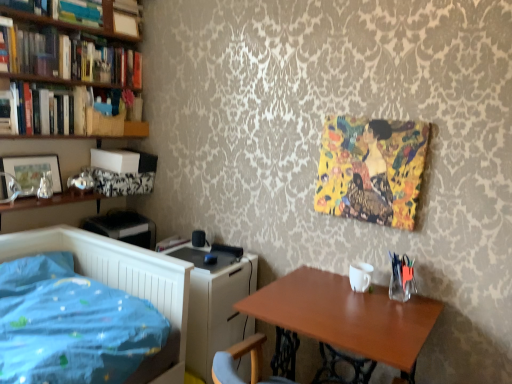
At what (x,y) coordinates should I click in order to perform the action: click on blue matte book at upper left, the 2th book when ordered from top to bottom. Please return your answer as a coordinate pair (x, y). The height and width of the screenshot is (384, 512). Looking at the image, I should click on (77, 12).

At what (x,y) coordinates should I click in order to perform the action: click on matte silver picture frame at upper left. Please return your answer as a coordinate pair (x, y). The height and width of the screenshot is (384, 512). Looking at the image, I should click on (32, 171).

This screenshot has height=384, width=512. What do you see at coordinates (371, 169) in the screenshot?
I see `yellow fabric painting at upper right` at bounding box center [371, 169].

Measure the distance between hardcover books at upper left, the 4th book positioned from the top, and camera.

6.05 feet.

This screenshot has height=384, width=512. I want to click on hardcover book at center, acting as the 1th book starting from the bottom, so click(x=170, y=243).

Measure the distance between point (13,105) and camera.

The distance of point (13,105) from camera is 1.92 meters.

Locate an element on the screen. This screenshot has width=512, height=384. hardcover books at upper left, which is counted as the third book, starting from the top is located at coordinates (75, 24).

I want to click on blue matte book at upper left, the 5th book when ordered from bottom to top, so (x=77, y=12).

From the image's perspective, is yellow fabric painting at upper right above or below hardcover books at upper left, which is counted as the third book, starting from the top?

yellow fabric painting at upper right is situated lower than hardcover books at upper left, which is counted as the third book, starting from the top, in the image.

Looking at this image, can you confirm if yellow fabric painting at upper right is thinner than hardcover books at upper left, which is counted as the fourth book, starting from the bottom?

Yes.

Find the location of `art lying in front of the hardcover books at upper left, which is counted as the third book, starting from the top`. art lying in front of the hardcover books at upper left, which is counted as the third book, starting from the top is located at coordinates (371, 169).

Considering the sizes of yellow fabric painting at upper right and hardcover books at upper left, which is counted as the fourth book, starting from the bottom, in the image, is yellow fabric painting at upper right bigger or smaller than hardcover books at upper left, which is counted as the fourth book, starting from the bottom,?

yellow fabric painting at upper right is smaller than hardcover books at upper left, which is counted as the fourth book, starting from the bottom.

Is matte silver picture frame at upper left aimed at wooden table at lower right?

No, matte silver picture frame at upper left is not aimed at wooden table at lower right.

From the image's perspective, between matte silver picture frame at upper left and wooden table at lower right, who is located below?

wooden table at lower right is shown below in the image.

Is matte silver picture frame at upper left wider or thinner than wooden table at lower right?

Clearly, matte silver picture frame at upper left has less width compared to wooden table at lower right.

From a real-world perspective, is matte white book at upper left, which is the 1th book in top-to-bottom order, positioned above or below white glossy computer desk at center?

In terms of real-world spatial position, matte white book at upper left, which is the 1th book in top-to-bottom order, is above white glossy computer desk at center.

Who is smaller, matte white book at upper left, which is the 1th book in top-to-bottom order, or white glossy computer desk at center?

With smaller size is matte white book at upper left, which is the 1th book in top-to-bottom order.

Considering the relative positions of matte white book at upper left, which is the 6th book from bottom to top, and white glossy computer desk at center in the image provided, is matte white book at upper left, which is the 6th book from bottom to top, to the right of white glossy computer desk at center from the viewer's perspective?

No.

Is hardcover books at upper left, which is counted as the fourth book, starting from the bottom, inside the boundaries of white glossy computer desk at center, or outside?

The correct answer is: outside.

From a real-world perspective, is hardcover books at upper left, which is counted as the fourth book, starting from the bottom, under white glossy computer desk at center?

Actually, hardcover books at upper left, which is counted as the fourth book, starting from the bottom, is physically above white glossy computer desk at center in the real world.

Is hardcover books at upper left, which is counted as the third book, starting from the top, facing towards white glossy computer desk at center?

No, hardcover books at upper left, which is counted as the third book, starting from the top, is not turned towards white glossy computer desk at center.

Looking at this image, is matte silver picture frame at upper left surrounding blue matte book at upper left, the 5th book when ordered from bottom to top?

Definitely not — blue matte book at upper left, the 5th book when ordered from bottom to top, is not inside matte silver picture frame at upper left.

Is matte silver picture frame at upper left facing towards blue matte book at upper left, the 5th book when ordered from bottom to top?

No, matte silver picture frame at upper left is not turned towards blue matte book at upper left, the 5th book when ordered from bottom to top.

Would you say yellow fabric painting at upper right is a long distance from matte silver picture frame at upper left?

That's right, there is a large distance between yellow fabric painting at upper right and matte silver picture frame at upper left.

Locate an element on the screen. art located on the right of matte silver picture frame at upper left is located at coordinates (371, 169).

Does yellow fabric painting at upper right have a lesser width compared to matte silver picture frame at upper left?

Yes.

Which is closer to the camera, [340,173] or [20,168]?

Point [340,173]

Is white glossy computer desk at center positioned with its back to matte white book at upper left, which is the 1th book in top-to-bottom order?

No, white glossy computer desk at center's orientation is not away from matte white book at upper left, which is the 1th book in top-to-bottom order.

Is point (200, 318) in front of point (117, 18)?

Yes, point (200, 318) is closer to viewer.

Which is in front, white glossy computer desk at center or matte white book at upper left, which is the 6th book from bottom to top?

white glossy computer desk at center is closer to the camera.

What's the angular difference between white glossy computer desk at center and matte white book at upper left, which is the 6th book from bottom to top,'s facing directions?

2.57 degrees.

Where is `book that is the 4th object to the left of the yellow fabric painting at upper right, starting at the anchor`? The width and height of the screenshot is (512, 384). book that is the 4th object to the left of the yellow fabric painting at upper right, starting at the anchor is located at coordinates (75, 24).

This screenshot has width=512, height=384. What are the coordinates of `picture frame behind the wooden table at lower right` in the screenshot? It's located at (32, 171).

Which object lies further to the anchor point white glossy computer desk at center, yellow fabric painting at upper right or matte silver picture frame at upper left?

Based on the image, matte silver picture frame at upper left appears to be further to white glossy computer desk at center.

Which object lies nearer to the anchor point blue matte book at upper left, the 2th book when ordered from top to bottom, white glossy computer desk at center or wooden table at lower right?

The object closer to blue matte book at upper left, the 2th book when ordered from top to bottom, is white glossy computer desk at center.

Looking at the image, which one is located further to matte silver picture frame at upper left, hardcover book at center, arranged as the sixth book when viewed from the top, or white glossy computer desk at center?

white glossy computer desk at center.

Looking at the image, which one is located further to matte silver picture frame at upper left, white glossy computer desk at center or hardcover book at center, arranged as the sixth book when viewed from the top?

white glossy computer desk at center is further to matte silver picture frame at upper left.

When comparing their distances from blue matte book at upper left, the 5th book when ordered from bottom to top, does hardcover book at center, acting as the 1th book starting from the bottom, or wooden table at lower right seem closer?

Based on the image, hardcover book at center, acting as the 1th book starting from the bottom, appears to be nearer to blue matte book at upper left, the 5th book when ordered from bottom to top.

Estimate the real-world distances between objects in this image. Which object is closer to hardcover books at upper left, the 4th book positioned from the top, white glossy computer desk at center or wooden table at lower right?

white glossy computer desk at center is closer to hardcover books at upper left, the 4th book positioned from the top.

When comparing their distances from hardcover books at upper left, which is counted as the fourth book, starting from the bottom, does matte white book at upper left, which is the 6th book from bottom to top, or matte silver picture frame at upper left seem closer?

The object closer to hardcover books at upper left, which is counted as the fourth book, starting from the bottom, is matte white book at upper left, which is the 6th book from bottom to top.

Looking at the image, which one is located further to hardcover book at center, acting as the 1th book starting from the bottom, hardcover books at left, the fifth book from the top, or wooden table at lower right?

wooden table at lower right is positioned further to the anchor hardcover book at center, acting as the 1th book starting from the bottom.

In order to click on picture frame between matte white book at upper left, which is the 6th book from bottom to top, and hardcover book at center, acting as the 1th book starting from the bottom, from top to bottom in this screenshot , I will do `click(32, 171)`.

Identify the location of picture frame that lies between matte white book at upper left, which is the 6th book from bottom to top, and wooden table at lower right from top to bottom. (32, 171).

Where is `art that lies between hardcover books at upper left, which is counted as the third book, starting from the top, and wooden table at lower right from top to bottom`? art that lies between hardcover books at upper left, which is counted as the third book, starting from the top, and wooden table at lower right from top to bottom is located at coordinates (371, 169).

Where is `book between hardcover books at upper left, acting as the third book starting from the bottom, and hardcover book at center, arranged as the sixth book when viewed from the top, vertically`? book between hardcover books at upper left, acting as the third book starting from the bottom, and hardcover book at center, arranged as the sixth book when viewed from the top, vertically is located at coordinates (67, 114).